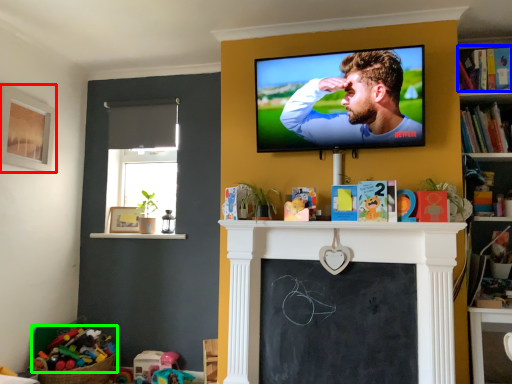
Question: Considering the real-world distances, which object is closest to picture frame (highlighted by a red box)? book (highlighted by a blue box) or toy (highlighted by a green box).

Choices:
 (A) book
 (B) toy

Answer: (B)